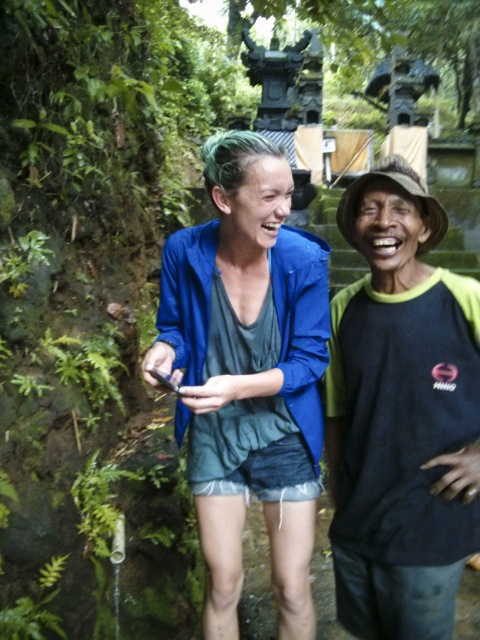
Question: In this image, where is blue denim shorts at lower center located relative to black matte hat at upper right?

Choices:
 (A) right
 (B) left

Answer: (B)

Question: Is blue denim shorts at lower center to the left of black matte hat at upper right from the viewer's perspective?

Choices:
 (A) no
 (B) yes

Answer: (B)

Question: Can you confirm if blue denim shorts at lower center is smaller than black matte hat at upper right?

Choices:
 (A) no
 (B) yes

Answer: (A)

Question: Which of the following is the closest to the observer?

Choices:
 (A) blue denim shorts at lower center
 (B) black matte hat at upper right

Answer: (A)